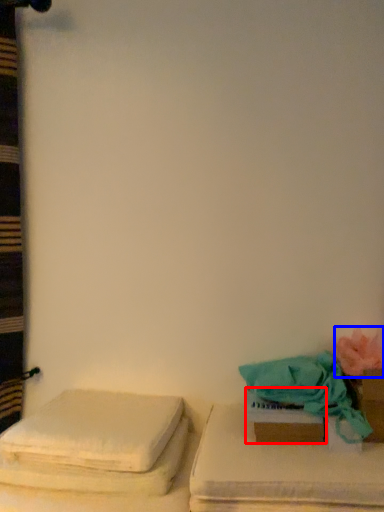
Question: Which object appears closest to the camera in this image, box (highlighted by a red box) or flower (highlighted by a blue box)?

Choices:
 (A) box
 (B) flower

Answer: (B)